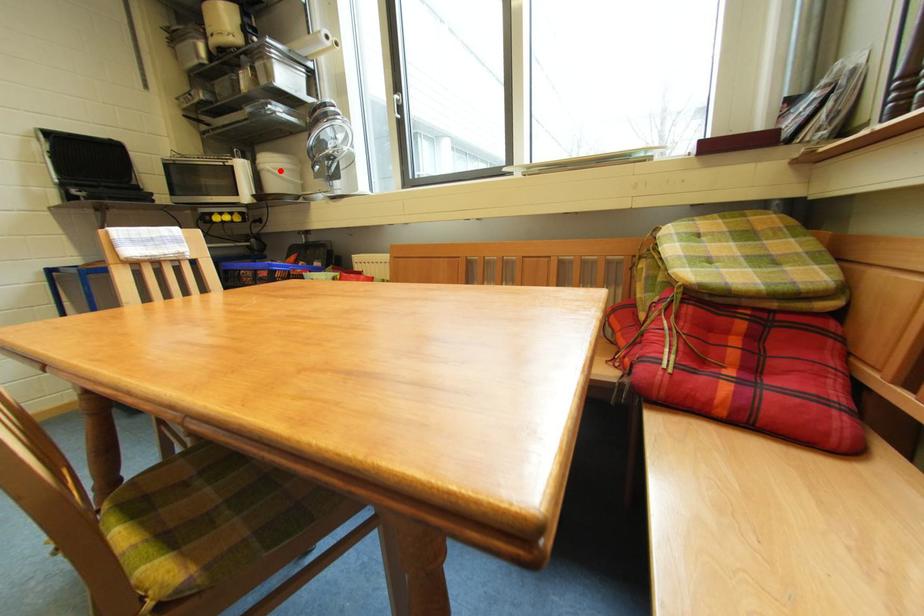
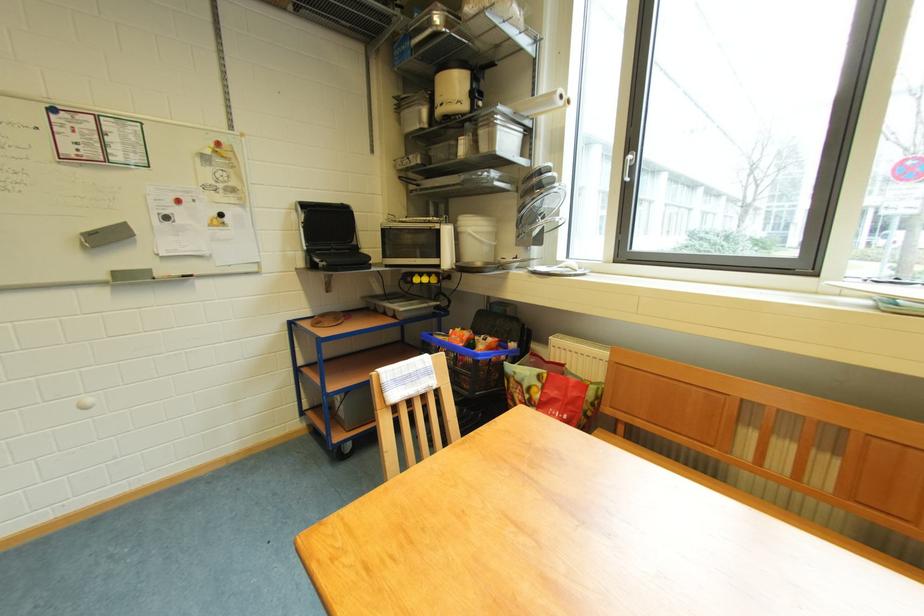
Locate, in the second image, the point that corresponds to the highlighted location in the first image.

(481, 235)